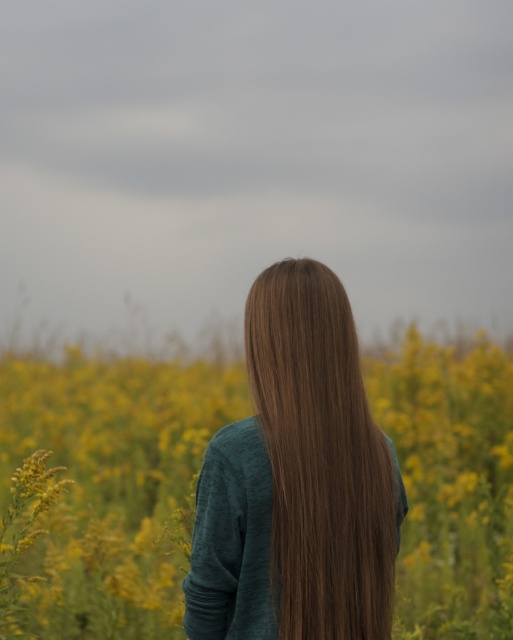
Question: Where is yellow soft textured flowers at center located in relation to brown smooth hair at center in the image?

Choices:
 (A) above
 (B) below

Answer: (B)

Question: Observing the image, what is the correct spatial positioning of yellow soft textured flowers at center in reference to brown smooth hair at center?

Choices:
 (A) left
 (B) right

Answer: (A)

Question: Can you confirm if yellow soft textured flowers at center is bigger than brown smooth hair at center?

Choices:
 (A) yes
 (B) no

Answer: (B)

Question: Among these objects, which one is farthest from the camera?

Choices:
 (A) yellow soft textured flowers at center
 (B) brown smooth hair at center

Answer: (A)

Question: Which point is closer to the camera?

Choices:
 (A) (292, 307)
 (B) (189, 520)

Answer: (A)